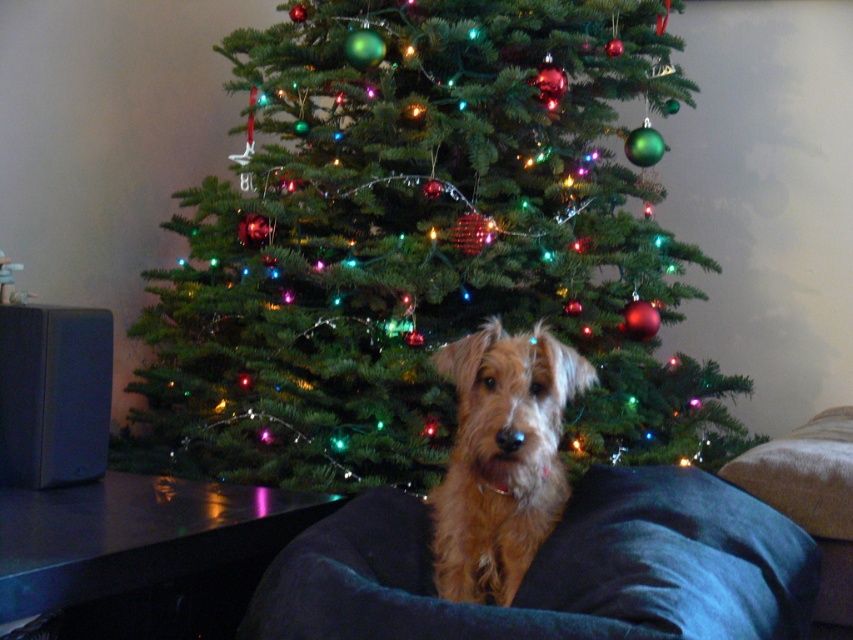
Question: Based on their relative distances, which object is farther from the brown furry dog at center?

Choices:
 (A) green matte christmas tree at center
 (B) dark blue fabric dog bed at center

Answer: (A)

Question: Can you confirm if dark blue fabric dog bed at center is positioned to the left of brown furry dog at center?

Choices:
 (A) no
 (B) yes

Answer: (A)

Question: Which object is the farthest from the green matte christmas tree at center?

Choices:
 (A) brown furry dog at center
 (B) dark blue fabric dog bed at center

Answer: (A)

Question: In this image, where is green matte christmas tree at center located relative to brown furry dog at center?

Choices:
 (A) right
 (B) left

Answer: (B)

Question: Does dark blue fabric dog bed at center have a greater width compared to brown furry dog at center?

Choices:
 (A) yes
 (B) no

Answer: (A)

Question: Which point appears closest to the camera in this image?

Choices:
 (A) (267, 51)
 (B) (506, 568)

Answer: (B)